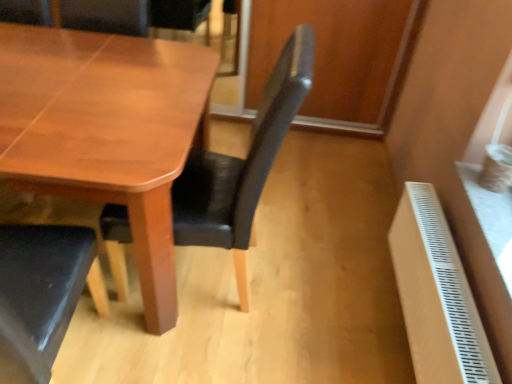
You are a GUI agent. You are given a task and a screenshot of the screen. Output one action in this format:
    pyautogui.click(x=<x>, y=<y>)
    Task: Click on the free space underneath satin black chair at center (from a real-world perspective)
    This screenshot has height=384, width=512.
    Given the screenshot: What is the action you would take?
    pyautogui.click(x=226, y=283)